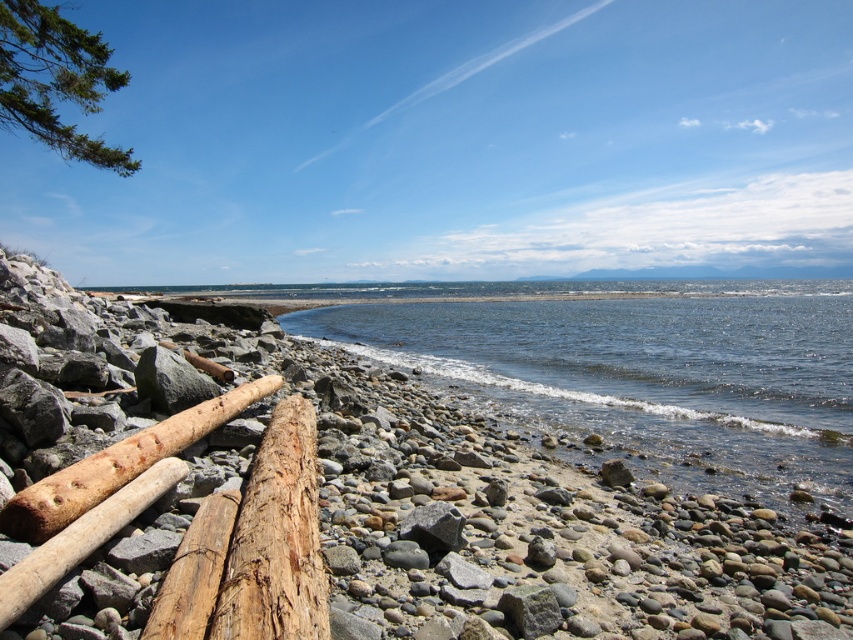
At what (x,y) coordinates should I click in order to perform the action: click on gray rock at center. Please return your answer as a coordinate pair (x, y). This screenshot has height=640, width=853. Looking at the image, I should click on (341, 502).

Is point (160, 556) farther from camera compared to point (404, 524)?

No, (160, 556) is closer to viewer.

Locate an element on the screen. Image resolution: width=853 pixels, height=640 pixels. gray rock at center is located at coordinates (341, 502).

Between clear water at center and gray matte rock at center, which one has less height?

With less height is gray matte rock at center.

Who is positioned more to the right, clear water at center or gray matte rock at center?

clear water at center is more to the right.

Does point (624, 340) lie behind point (461, 540)?

Yes, it is behind point (461, 540).

Image resolution: width=853 pixels, height=640 pixels. Find the location of `clear water at center`. clear water at center is located at coordinates (643, 378).

Between gray rock at center and brown rough wood at lower left, which one has less height?

brown rough wood at lower left is shorter.

Is point (740, 600) behind point (207, 412)?

No, (740, 600) is in front of (207, 412).

Between point (128, 618) and point (113, 492), which one is positioned in front?

Point (128, 618)

Identify the location of gray rock at center. The image size is (853, 640). (x=341, y=502).